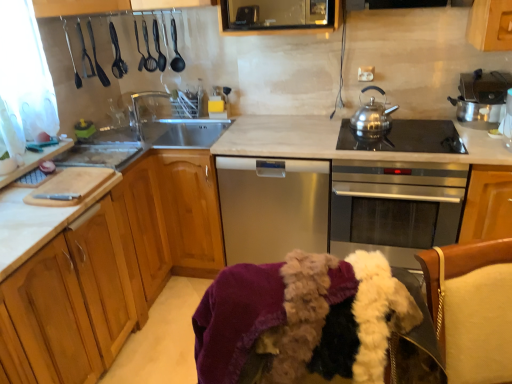
The height and width of the screenshot is (384, 512). In order to click on free space in front of transparent glass tap at center in this screenshot , I will do `click(153, 148)`.